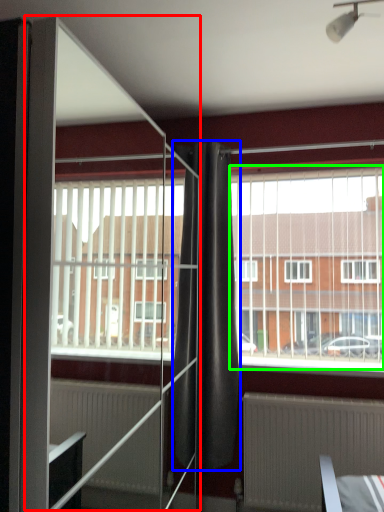
Question: Which object is the closest to the screen door (highlighted by a red box)? Choose among these: curtain (highlighted by a blue box) or window screen (highlighted by a green box).

Choices:
 (A) curtain
 (B) window screen

Answer: (A)